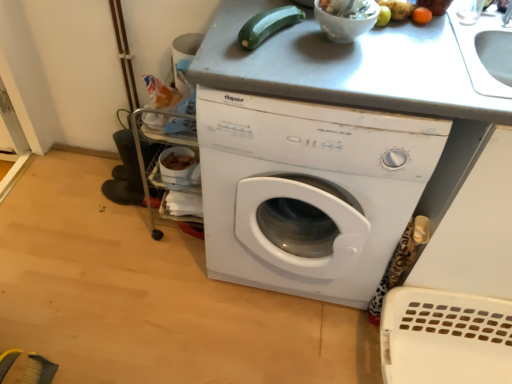
Identify the location of vacant space situated on the left part of orange matte fruit at upper right, the 1th vegetable when ordered from right to left. (379, 35).